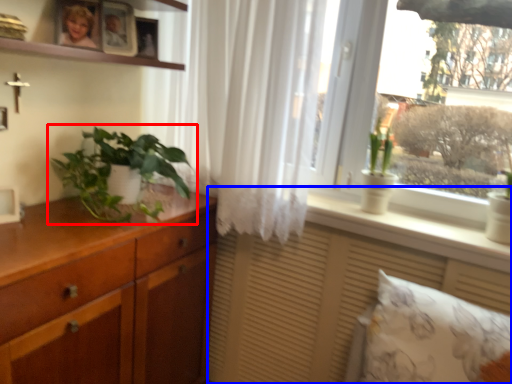
Question: Which of the following is the closest to the observer, houseplant (highlighted by a red box) or vanity (highlighted by a blue box)?

Choices:
 (A) houseplant
 (B) vanity

Answer: (A)